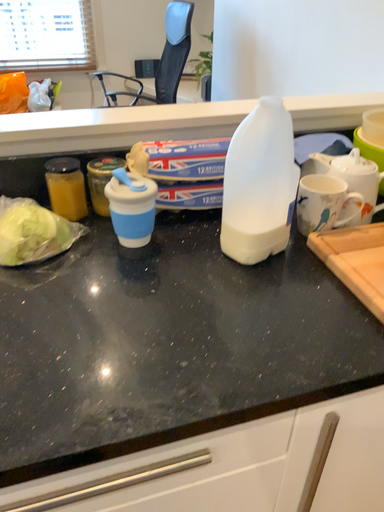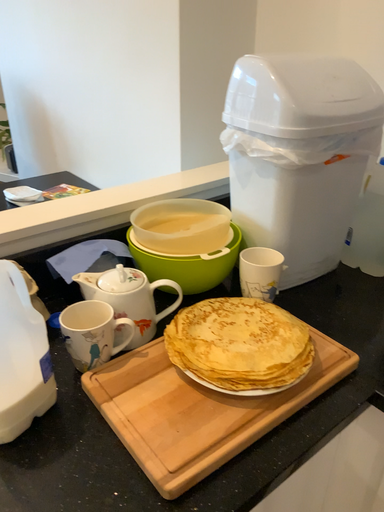
Question: Which way did the camera rotate in the video?

Choices:
 (A) rotated downward
 (B) rotated upward

Answer: (B)